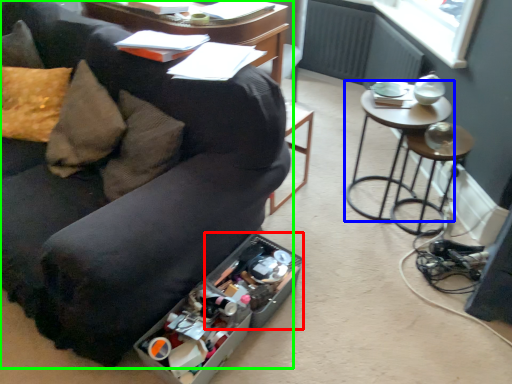
Question: Estimate the real-world distances between objects in this image. Which object is closer to storage box (highlighted by a red box), table (highlighted by a blue box) or studio couch (highlighted by a green box)?

Choices:
 (A) table
 (B) studio couch

Answer: (B)